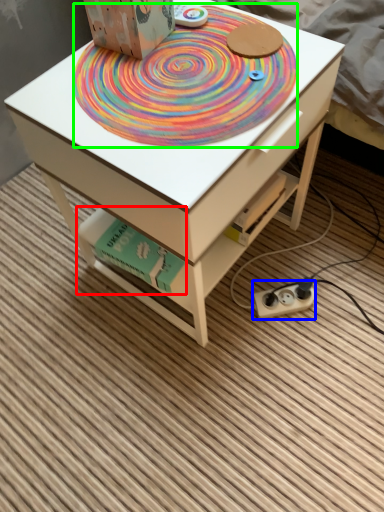
Question: Which object is the farthest from book (highlighted by a red box)? Choose among these: plug (highlighted by a blue box) or mat (highlighted by a green box).

Choices:
 (A) plug
 (B) mat

Answer: (A)